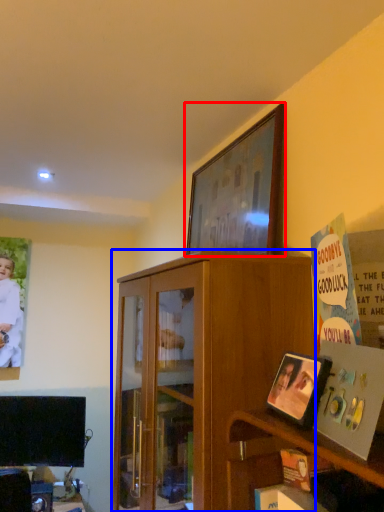
Question: Which object is closer to the camera taking this photo, picture frame (highlighted by a red box) or cabinetry (highlighted by a blue box)?

Choices:
 (A) picture frame
 (B) cabinetry

Answer: (B)